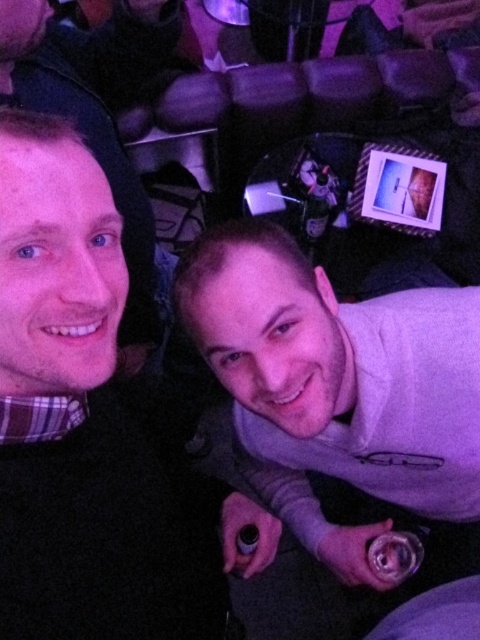
Question: Which object is farther from the camera taking this photo?

Choices:
 (A) matte black sweater at left
 (B) matte black shirt at left

Answer: (B)

Question: Is matte black sweater at left positioned behind gray fleece sweater at center?

Choices:
 (A) no
 (B) yes

Answer: (A)

Question: Which point is farther to the camera?

Choices:
 (A) gray fleece sweater at center
 (B) matte black shirt at left

Answer: (B)

Question: Among these objects, which one is farthest from the camera?

Choices:
 (A) gray fleece sweater at center
 (B) matte black shirt at left
 (C) matte black sweater at left

Answer: (B)

Question: Does matte black sweater at left have a smaller size compared to gray fleece sweater at center?

Choices:
 (A) no
 (B) yes

Answer: (B)

Question: Does matte black sweater at left come behind gray fleece sweater at center?

Choices:
 (A) yes
 (B) no

Answer: (B)